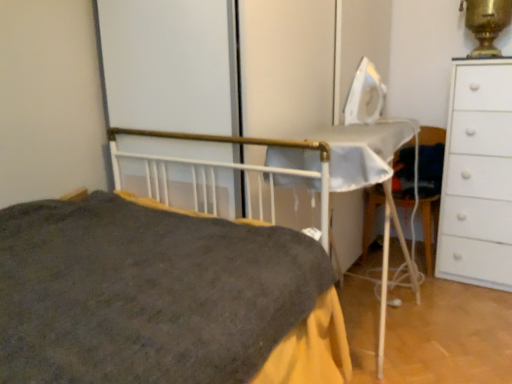
Locate an element on the screen. This screenshot has width=512, height=384. free space in front of white matte chest of drawers at right is located at coordinates (473, 302).